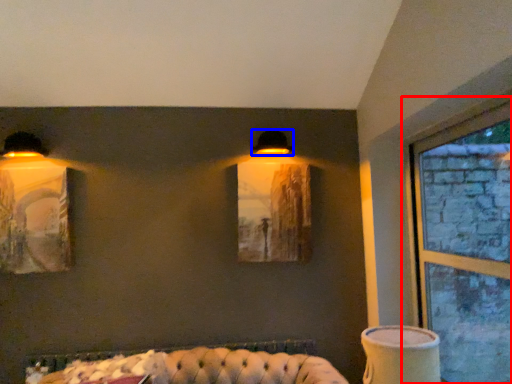
Question: Which of the following is the farthest to the observer, window (highlighted by a red box) or lamp (highlighted by a blue box)?

Choices:
 (A) window
 (B) lamp

Answer: (B)